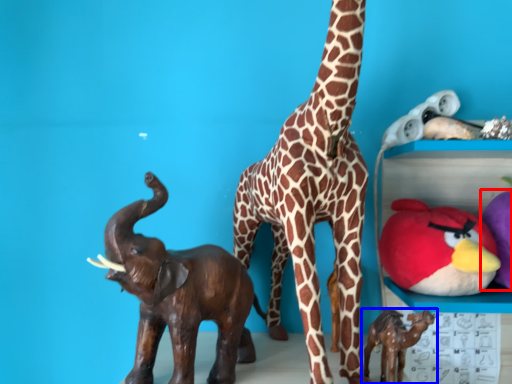
Question: Among these objects, which one is farthest to the camera, toy (highlighted by a red box) or toy (highlighted by a blue box)?

Choices:
 (A) toy
 (B) toy

Answer: (A)